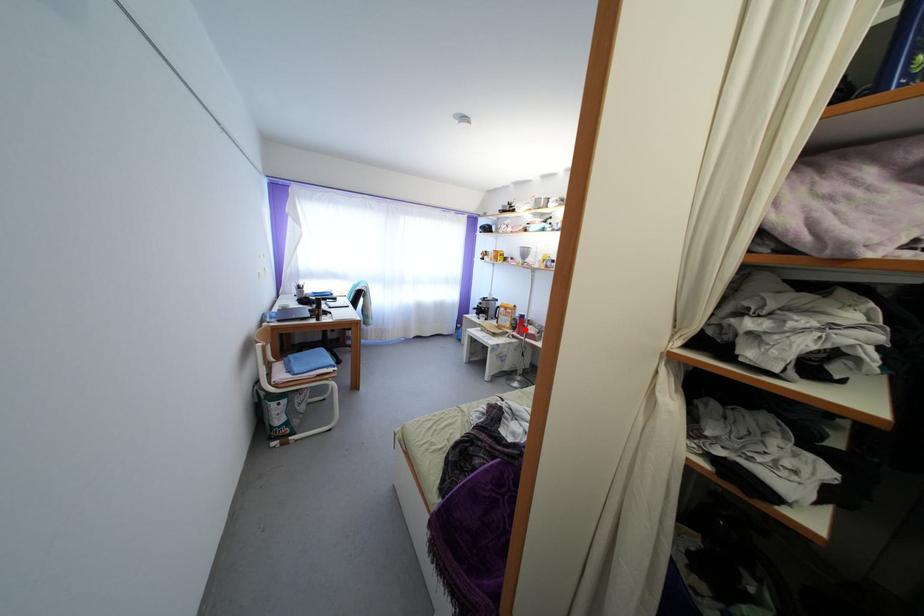
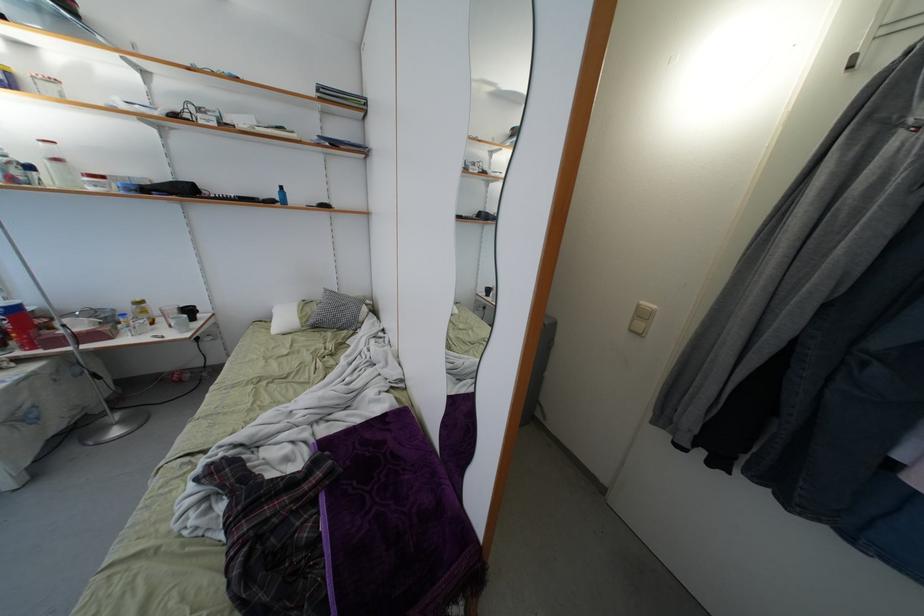
Question: I am providing you with two images of the same scene from different viewpoints. A red point is shown in image1. For the corresponding object point in image2, is it positioned nearer or farther from the camera?

Choices:
 (A) Nearer
 (B) Farther

Answer: (B)